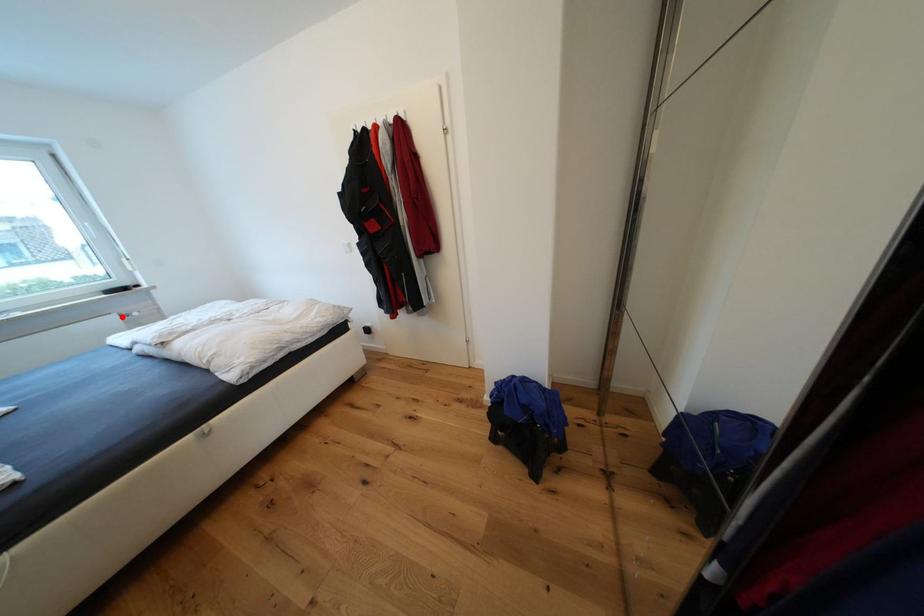
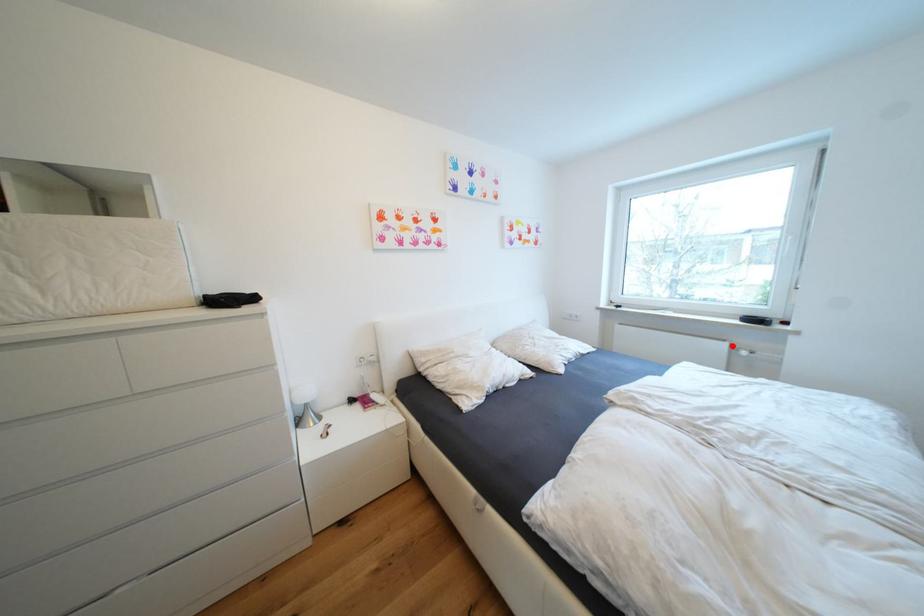
I am providing you with two images of the same scene from different viewpoints. A red point is marked on the first image and another point is marked on the second image. Is the red point in image1 aligned with the point shown in image2?

Yes